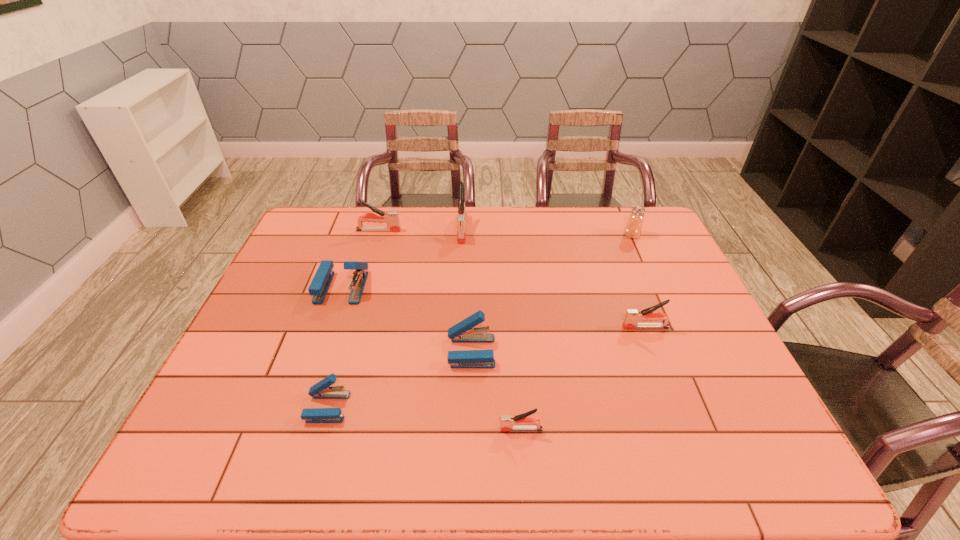
You are a GUI agent. You are given a task and a screenshot of the screen. Output one action in this format:
    pyautogui.click(x=<x>, y=<y>)
    Task: Click on the object located in the far right corner section of the desktop
    This screenshot has height=540, width=960.
    Given the screenshot: What is the action you would take?
    pyautogui.click(x=633, y=228)

Locate an element on the screen. This screenshot has height=540, width=960. free space at the far edge is located at coordinates (482, 212).

In the image, there is a desktop. At what (x,y) coordinates should I click in order to perform the action: click on vacant region at the near edge. Please return your answer as a coordinate pair (x, y). This screenshot has width=960, height=540. Looking at the image, I should click on (396, 454).

This screenshot has height=540, width=960. In order to click on vacant space at the left edge in this screenshot , I will do `click(300, 330)`.

Identify the location of vacant area at the right edge of the desktop. The image size is (960, 540). (693, 333).

Identify the location of vacant area at the far left corner. (324, 212).

Where is `vacant space at the near left corner of the desktop`? This screenshot has height=540, width=960. vacant space at the near left corner of the desktop is located at coordinates (212, 472).

At what (x,y) coordinates should I click in order to perform the action: click on free point at the far right corner. Please return your answer as a coordinate pair (x, y). The height and width of the screenshot is (540, 960). Looking at the image, I should click on (657, 237).

This screenshot has height=540, width=960. I want to click on free spot between the fifth nearest stapler and the saltshaker, so tap(487, 261).

Find the location of a particular element. This screenshot has height=540, width=960. vacant space that's between the second gray stapler from left to right and the rightmost stapler is located at coordinates (554, 278).